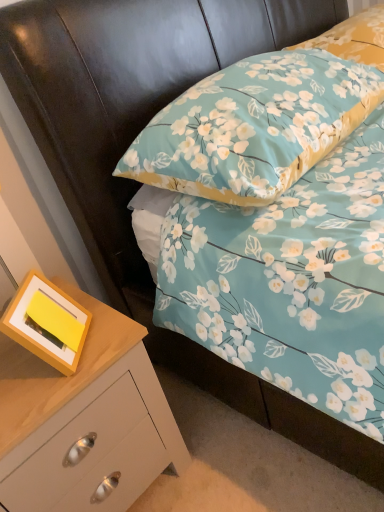
Question: Is floral fabric pillow at upper center, acting as the first pillow starting from the bottom, inside or outside of wooden chest of drawers at lower left?

Choices:
 (A) inside
 (B) outside

Answer: (B)

Question: From a real-world perspective, is floral fabric pillow at upper center, acting as the first pillow starting from the bottom, above or below wooden chest of drawers at lower left?

Choices:
 (A) above
 (B) below

Answer: (A)

Question: Estimate the real-world distances between objects in this image. Which object is closer to the floral fabric pillow at upper center, acting as the first pillow starting from the bottom?

Choices:
 (A) yellow matte picture frame at lower left
 (B) floral fabric pillow at upper right, the first pillow positioned from the top
 (C) wooden chest of drawers at lower left

Answer: (B)

Question: Which object is the closest to the floral fabric pillow at upper right, the first pillow positioned from the top?

Choices:
 (A) floral fabric pillow at upper center, acting as the first pillow starting from the bottom
 (B) yellow matte picture frame at lower left
 (C) wooden chest of drawers at lower left

Answer: (A)